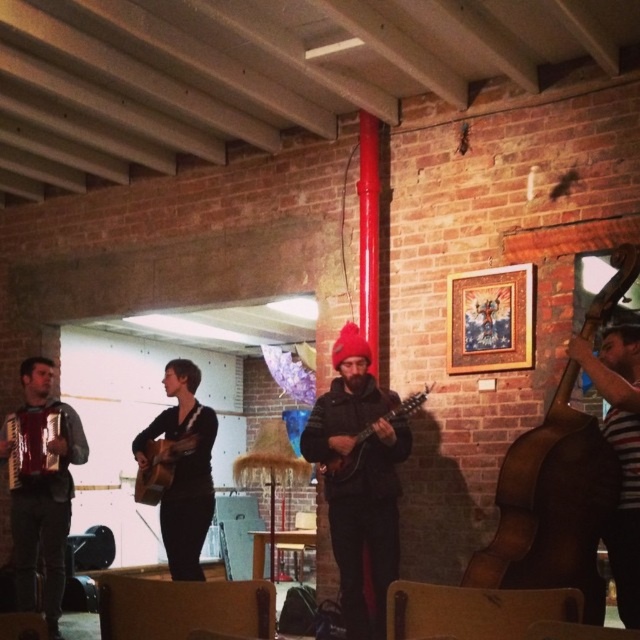
Which is above, black matte guitar at center or wooden acoustic guitar at center?

Positioned higher is wooden acoustic guitar at center.

Is point (179, 573) closer to camera compared to point (170, 449)?

No, it is not.

Describe the element at coordinates (182, 468) in the screenshot. I see `black matte guitar at center` at that location.

The image size is (640, 640). Identify the location of black matte guitar at center. (182, 468).

The width and height of the screenshot is (640, 640). Describe the element at coordinates (40, 486) in the screenshot. I see `matte black accordion at left` at that location.

Which is behind, point (29, 454) or point (33, 483)?

Positioned behind is point (33, 483).

Where is `matte black accordion at left`? matte black accordion at left is located at coordinates (40, 486).

Can you confirm if striped fabric at right is thinner than wooden acoustic guitar at center?

Yes.

Between striped fabric at right and wooden acoustic guitar at center, which one appears on the right side from the viewer's perspective?

From the viewer's perspective, striped fabric at right appears more on the right side.

Between point (604, 433) and point (161, 460), which one is positioned in front?

Positioned in front is point (604, 433).

Find the location of a particular element. striped fabric at right is located at coordinates (620, 451).